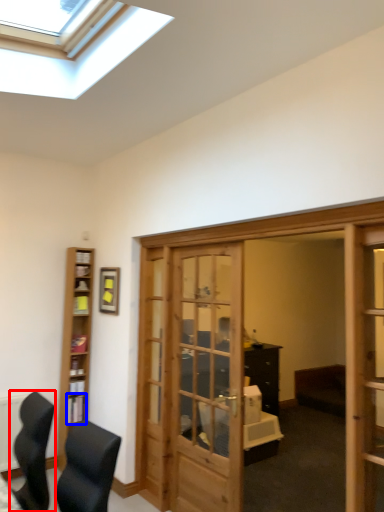
Question: Which object appears farthest to the camera in this image, chair (highlighted by a red box) or shelf (highlighted by a blue box)?

Choices:
 (A) chair
 (B) shelf

Answer: (B)